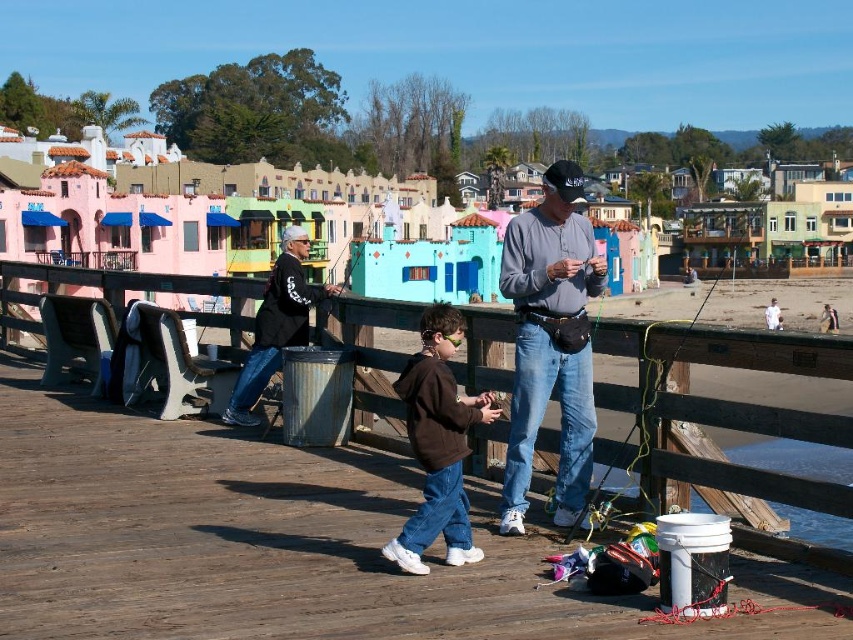
Identify the location of wooden rail at center. (723, 406).

The height and width of the screenshot is (640, 853). Describe the element at coordinates (723, 406) in the screenshot. I see `wooden rail at center` at that location.

Find the location of a particular element. The image size is (853, 640). wooden rail at center is located at coordinates (723, 406).

Can you confirm if gray cotton shirt at center is positioned to the right of dark gray jacket at center?

Correct, you'll find gray cotton shirt at center to the right of dark gray jacket at center.

Is gray cotton shirt at center to the left of dark gray jacket at center from the viewer's perspective?

In fact, gray cotton shirt at center is to the right of dark gray jacket at center.

Between point (518, 321) and point (300, 268), which one is positioned behind?

Positioned behind is point (300, 268).

I want to click on gray cotton shirt at center, so click(550, 340).

Can you confirm if brown fleece jacket at center is positioned above metallic silver fishing pole at center?

No.

Is brown fleece jacket at center wider than metallic silver fishing pole at center?

No, brown fleece jacket at center is not wider than metallic silver fishing pole at center.

Is point (421, 449) positioned behind point (337, 269)?

No, it is not.

Find the location of a particular element. brown fleece jacket at center is located at coordinates (438, 444).